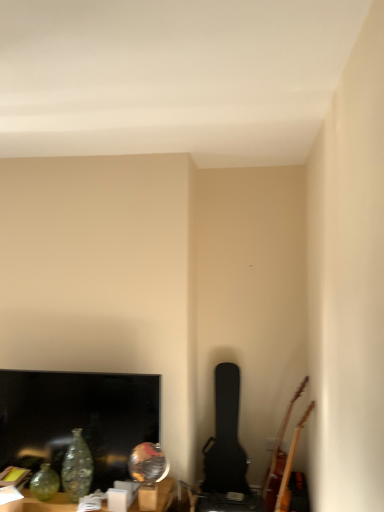
Question: Is matte black tv at lower left to the left of translucent glass vase at lower left from the viewer's perspective?

Choices:
 (A) yes
 (B) no

Answer: (B)

Question: Is matte black tv at lower left smaller than translucent glass vase at lower left?

Choices:
 (A) no
 (B) yes

Answer: (B)

Question: Considering the relative positions of matte black tv at lower left and translucent glass vase at lower left in the image provided, is matte black tv at lower left in front of translucent glass vase at lower left?

Choices:
 (A) no
 (B) yes

Answer: (A)

Question: Is matte black tv at lower left shorter than translucent glass vase at lower left?

Choices:
 (A) yes
 (B) no

Answer: (B)

Question: Is matte black tv at lower left outside of translucent glass vase at lower left?

Choices:
 (A) yes
 (B) no

Answer: (A)

Question: From the image's perspective, is black textured guitar case at center-right, arranged as the second guitar when viewed from the right, located above or below wooden acoustic guitar at lower right, arranged as the first guitar when viewed from the right?

Choices:
 (A) below
 (B) above

Answer: (A)

Question: In terms of width, does black textured guitar case at center-right, arranged as the second guitar when viewed from the right, look wider or thinner when compared to wooden acoustic guitar at lower right, arranged as the first guitar when viewed from the right?

Choices:
 (A) thin
 (B) wide

Answer: (A)

Question: From a real-world perspective, relative to wooden acoustic guitar at lower right, the second guitar from the left, is black textured guitar case at center-right, arranged as the second guitar when viewed from the right, vertically above or below?

Choices:
 (A) below
 (B) above

Answer: (A)

Question: Would you say black textured guitar case at center-right, which is the 1th guitar from left to right, is to the left or to the right of wooden acoustic guitar at lower right, arranged as the first guitar when viewed from the right, in the picture?

Choices:
 (A) right
 (B) left

Answer: (B)

Question: From a real-world perspective, is translucent glass vase at lower left positioned above or below black textured guitar case at center-right, arranged as the second guitar when viewed from the right?

Choices:
 (A) below
 (B) above

Answer: (A)

Question: Is point (33, 509) positioned closer to the camera than point (241, 475)?

Choices:
 (A) closer
 (B) farther

Answer: (A)

Question: Considering their positions, is translucent glass vase at lower left located in front of or behind black textured guitar case at center-right, arranged as the second guitar when viewed from the right?

Choices:
 (A) front
 (B) behind

Answer: (A)

Question: Is translucent glass vase at lower left wider or thinner than black textured guitar case at center-right, arranged as the second guitar when viewed from the right?

Choices:
 (A) thin
 (B) wide

Answer: (B)

Question: Would you say matte black tv at lower left is inside or outside black textured guitar case at center-right, arranged as the second guitar when viewed from the right?

Choices:
 (A) inside
 (B) outside

Answer: (B)

Question: Considering the relative positions of matte black tv at lower left and black textured guitar case at center-right, which is the 1th guitar from left to right, in the image provided, is matte black tv at lower left to the left or to the right of black textured guitar case at center-right, which is the 1th guitar from left to right,?

Choices:
 (A) left
 (B) right

Answer: (A)